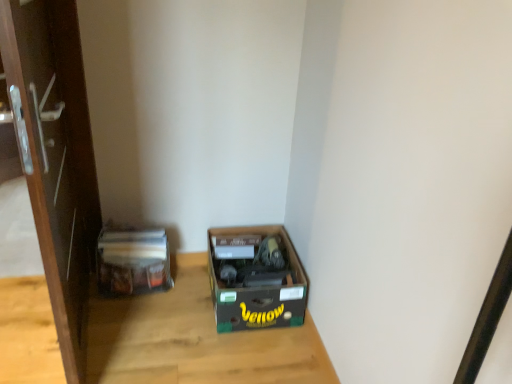
The width and height of the screenshot is (512, 384). In order to click on vacant space to the right of brown glossy door at left in this screenshot , I will do `click(163, 339)`.